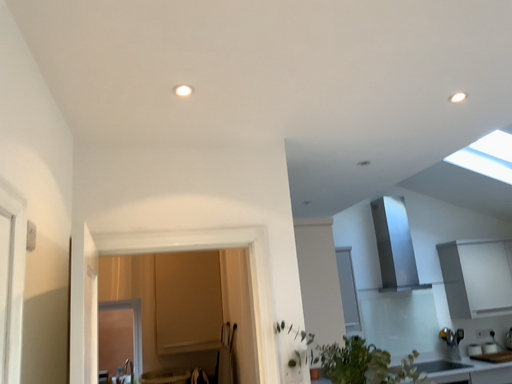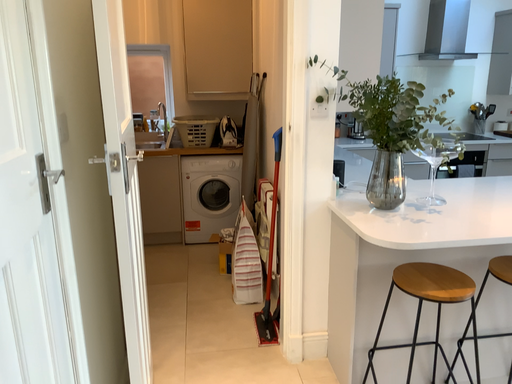
Question: Which way did the camera rotate in the video?

Choices:
 (A) rotated upward
 (B) rotated downward

Answer: (B)